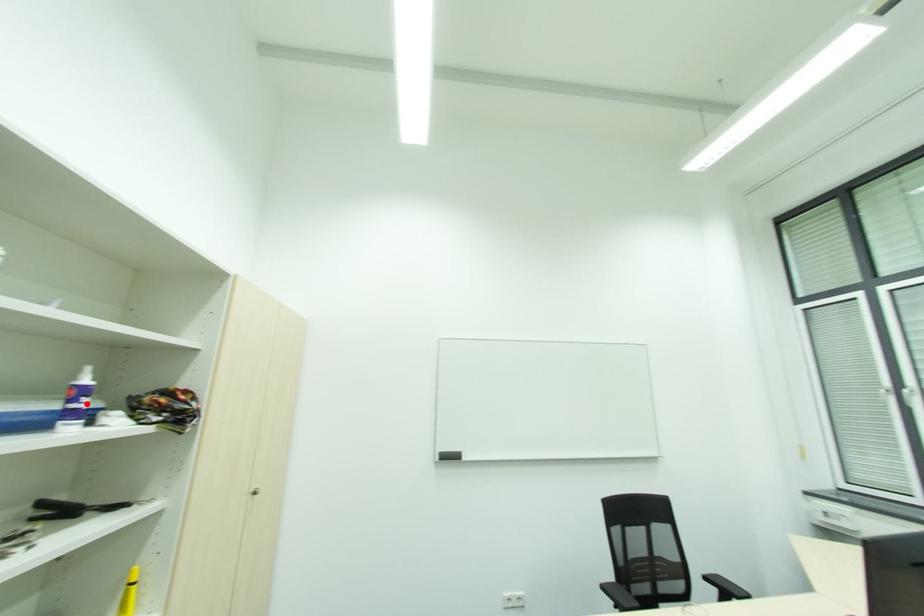
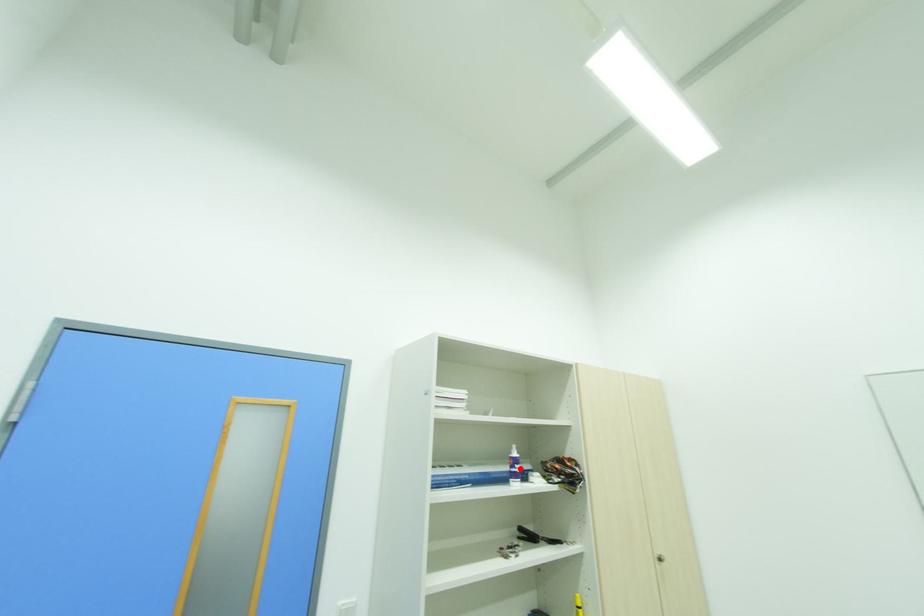
I am providing you with two images of the same scene from different viewpoints. A red point is marked on the first image and another point is marked on the second image. Do the highlighted points in image1 and image2 indicate the same real-world spot?

Yes